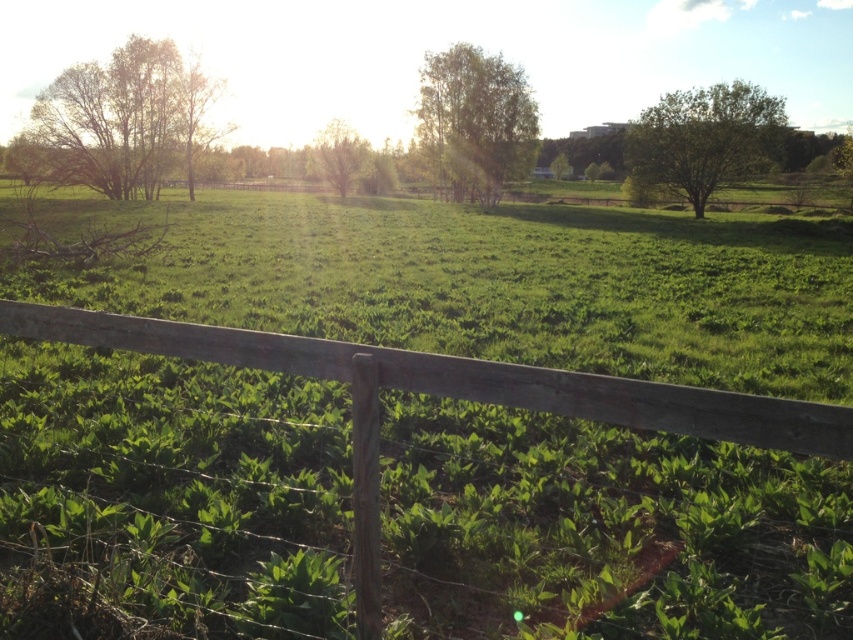
Question: Which is nearer to the weathered wood fence at lower center?

Choices:
 (A) green leafy tree at center
 (B) green leafy tree at upper right
 (C) green leafy tree at upper center
 (D) brown textured bush at upper left

Answer: (B)

Question: Estimate the real-world distances between objects in this image. Which object is farther from the brown textured bush at upper left?

Choices:
 (A) green leafy tree at upper center
 (B) weathered wood fence at lower center
 (C) green leafy tree at center

Answer: (B)

Question: Is brown textured bush at upper left bigger than green leafy tree at center?

Choices:
 (A) yes
 (B) no

Answer: (A)

Question: Which is nearer to the green leafy tree at center?

Choices:
 (A) green leafy tree at upper center
 (B) brown textured bush at upper left
 (C) weathered wood fence at lower center
 (D) green leafy tree at upper right

Answer: (A)

Question: Is the position of weathered wood fence at lower center less distant than that of green leafy tree at upper center?

Choices:
 (A) yes
 (B) no

Answer: (A)

Question: Can you confirm if green leafy tree at upper center is bigger than green leafy tree at center?

Choices:
 (A) yes
 (B) no

Answer: (A)